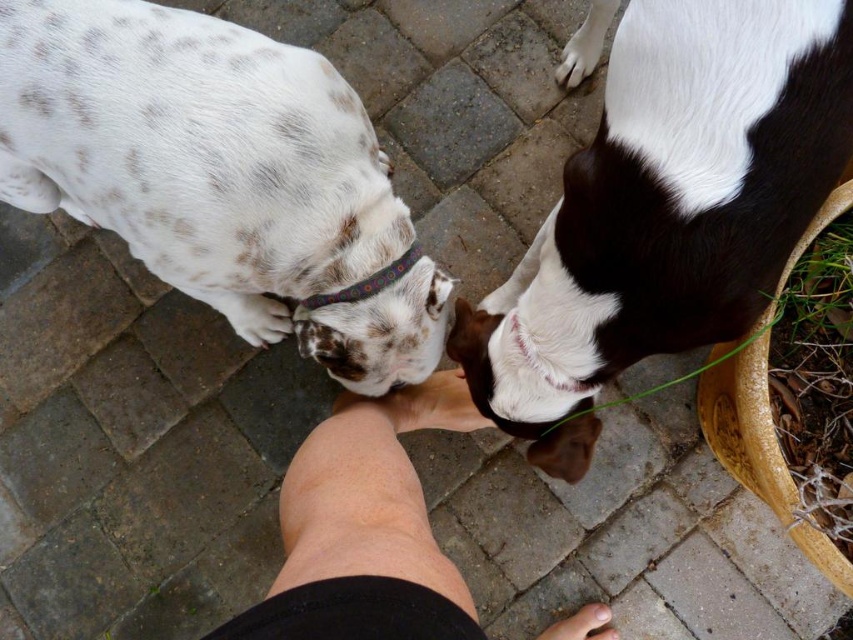
Can you confirm if spotted fur at center is smaller than multicolored fabric neckband at center?

Actually, spotted fur at center might be larger than multicolored fabric neckband at center.

Between point (123, 128) and point (299, 301), which one is positioned in front?

Point (123, 128)

Is point (392, 221) closer to viewer compared to point (325, 301)?

No, it is behind (325, 301).

Locate an element on the screen. spotted fur at center is located at coordinates (219, 173).

Can you confirm if white and brown fur at lower right is positioned below multicolored fabric neckband at center?

Incorrect, white and brown fur at lower right is not positioned below multicolored fabric neckband at center.

Does point (761, 218) lie in front of point (343, 296)?

That is True.

Identify the location of white and brown fur at lower right. This screenshot has height=640, width=853. (666, 209).

Can you confirm if skinny leg at center is taller than multicolored fabric neckband at center?

Indeed, skinny leg at center has a greater height compared to multicolored fabric neckband at center.

Who is more forward, (294, 486) or (347, 292)?

Point (294, 486) is more forward.

Where is `skinny leg at center`? skinny leg at center is located at coordinates (364, 529).